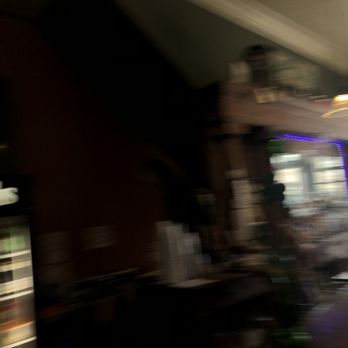
The width and height of the screenshot is (348, 348). I want to click on window reflection on mirror, so click(287, 180), click(290, 190), click(334, 187), click(333, 179), click(330, 162).